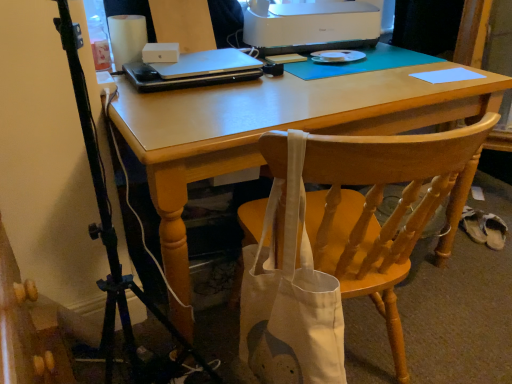
The height and width of the screenshot is (384, 512). I want to click on free point above light blue paper at upper right (from a real-world perspective), so click(x=445, y=75).